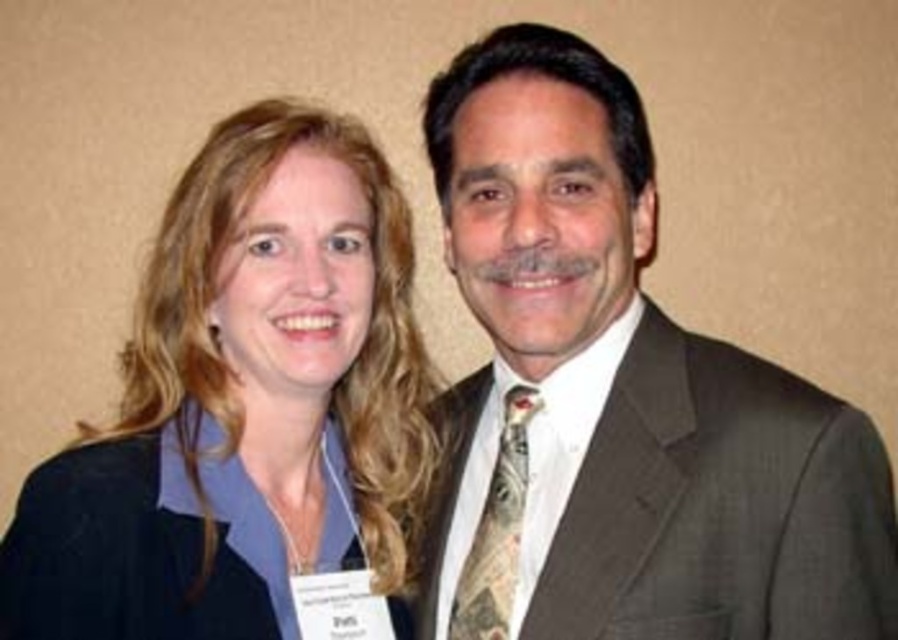
Question: Which object is the farthest from the dark brown suit at center?

Choices:
 (A) patterned silk tie at center
 (B) matte black blazer at center

Answer: (B)

Question: Which of the following is the farthest from the observer?

Choices:
 (A) (490, 595)
 (B) (786, 372)

Answer: (A)

Question: Does dark brown suit at center lie behind patterned silk tie at center?

Choices:
 (A) yes
 (B) no

Answer: (B)

Question: Considering the relative positions of matte black blazer at center and patterned silk tie at center in the image provided, where is matte black blazer at center located with respect to patterned silk tie at center?

Choices:
 (A) below
 (B) above

Answer: (B)

Question: Does dark brown suit at center appear over patterned silk tie at center?

Choices:
 (A) yes
 (B) no

Answer: (A)

Question: Which object is the closest to the patterned silk tie at center?

Choices:
 (A) dark brown suit at center
 (B) matte black blazer at center

Answer: (A)